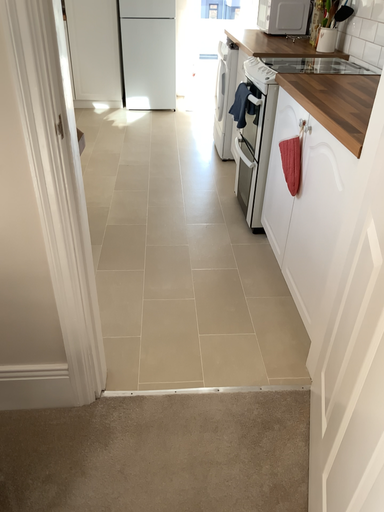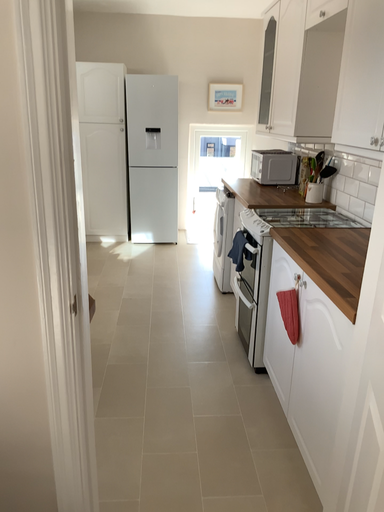
Question: Which way did the camera rotate in the video?

Choices:
 (A) rotated upward
 (B) rotated downward

Answer: (A)